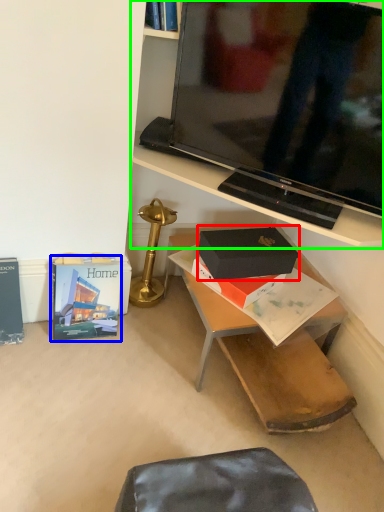
Question: Which object is the farthest from box (highlighted by a red box)? Choose among these: paperback book (highlighted by a blue box) or shelf (highlighted by a green box).

Choices:
 (A) paperback book
 (B) shelf

Answer: (A)